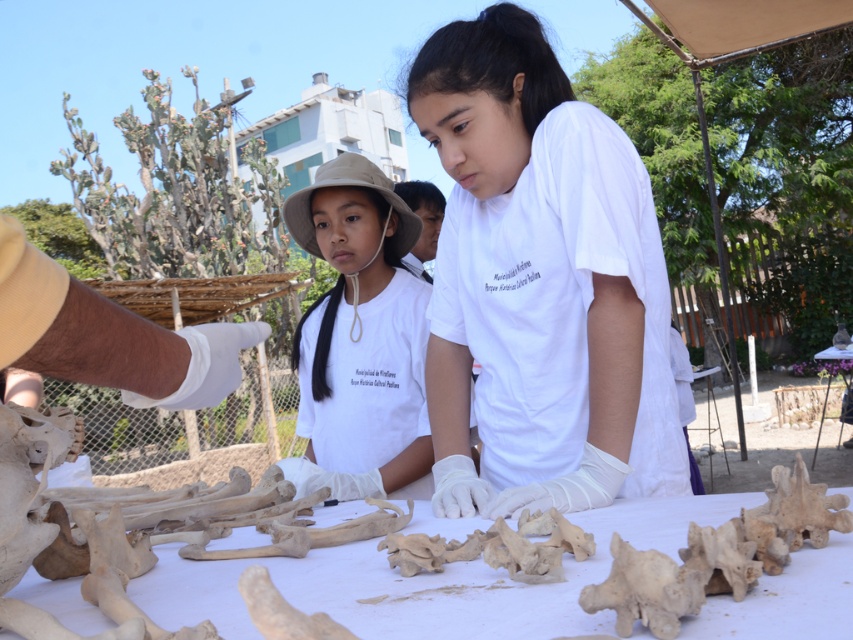
You are standing in the archaeological site and want to locate the white matte shirt at center. According to the coordinates provided, where would you look relative to the image frame?

The white matte shirt at center is located at the 2D coordinates point (x=540, y=284), which is approximately 44.4 percent from the left edge and 63.4 percent from the top edge of the image frame.

Based on the photo, you are a researcher trying to locate a specific point on the image. The point is labeled as point (540, 284). Based on the scene description, where would this point be located?

The point (540, 284) is on the white matte shirt at center.